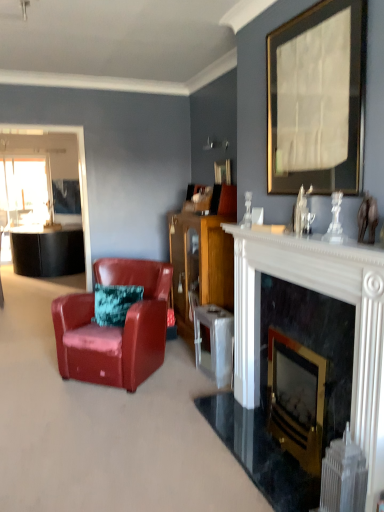
Question: From the image's perspective, is wooden cabinet at center above gold-framed paper at upper center, arranged as the first picture frame when viewed from the front?

Choices:
 (A) no
 (B) yes

Answer: (A)

Question: Is wooden cabinet at center positioned far away from gold-framed paper at upper center, which is the second picture frame in left-to-right order?

Choices:
 (A) no
 (B) yes

Answer: (B)

Question: Is wooden cabinet at center at the left side of gold-framed paper at upper center, which is the second picture frame in left-to-right order?

Choices:
 (A) yes
 (B) no

Answer: (A)

Question: Is wooden cabinet at center at the right side of gold-framed paper at upper center, which is the second picture frame in left-to-right order?

Choices:
 (A) yes
 (B) no

Answer: (B)

Question: Is wooden cabinet at center closer to camera compared to gold-framed paper at upper center, which is the second picture frame in left-to-right order?

Choices:
 (A) yes
 (B) no

Answer: (B)

Question: Is the depth of wooden cabinet at center greater than that of gold-framed paper at upper center, which appears as the first picture frame when viewed from the right?

Choices:
 (A) yes
 (B) no

Answer: (A)

Question: Is white plastic radiator at lower right at the right side of gold-framed paper at upper center, which appears as the first picture frame when viewed from the right?

Choices:
 (A) yes
 (B) no

Answer: (A)

Question: Does white plastic radiator at lower right appear on the left side of gold-framed paper at upper center, the 2th picture frame viewed from the back?

Choices:
 (A) no
 (B) yes

Answer: (A)

Question: Is white plastic radiator at lower right not inside gold-framed paper at upper center, arranged as the first picture frame when viewed from the front?

Choices:
 (A) no
 (B) yes

Answer: (B)

Question: Could you tell me if white plastic radiator at lower right is turned towards gold-framed paper at upper center, which is the second picture frame in left-to-right order?

Choices:
 (A) yes
 (B) no

Answer: (B)

Question: Can you confirm if white plastic radiator at lower right is wider than gold-framed paper at upper center, which appears as the first picture frame when viewed from the right?

Choices:
 (A) yes
 (B) no

Answer: (A)

Question: Can you confirm if white plastic radiator at lower right is bigger than gold-framed paper at upper center, the 2th picture frame viewed from the back?

Choices:
 (A) no
 (B) yes

Answer: (A)

Question: Is wooden cabinet at center thinner than clear glass window screen at left?

Choices:
 (A) no
 (B) yes

Answer: (A)